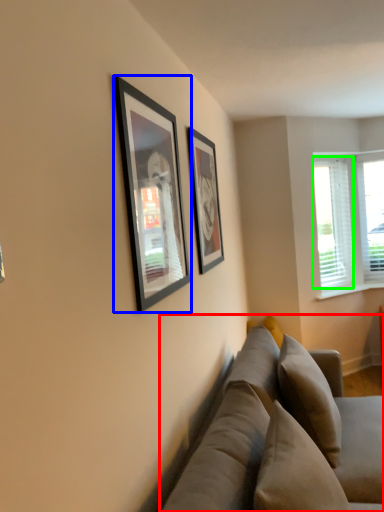
Question: Estimate the real-world distances between objects in this image. Which object is closer to studio couch (highlighted by a red box), picture frame (highlighted by a blue box) or window screen (highlighted by a green box)?

Choices:
 (A) picture frame
 (B) window screen

Answer: (A)